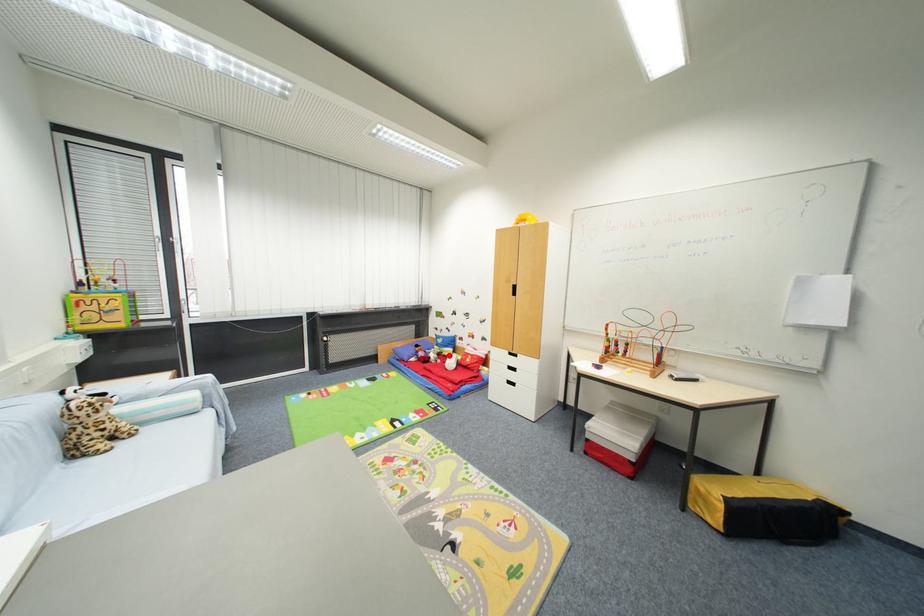
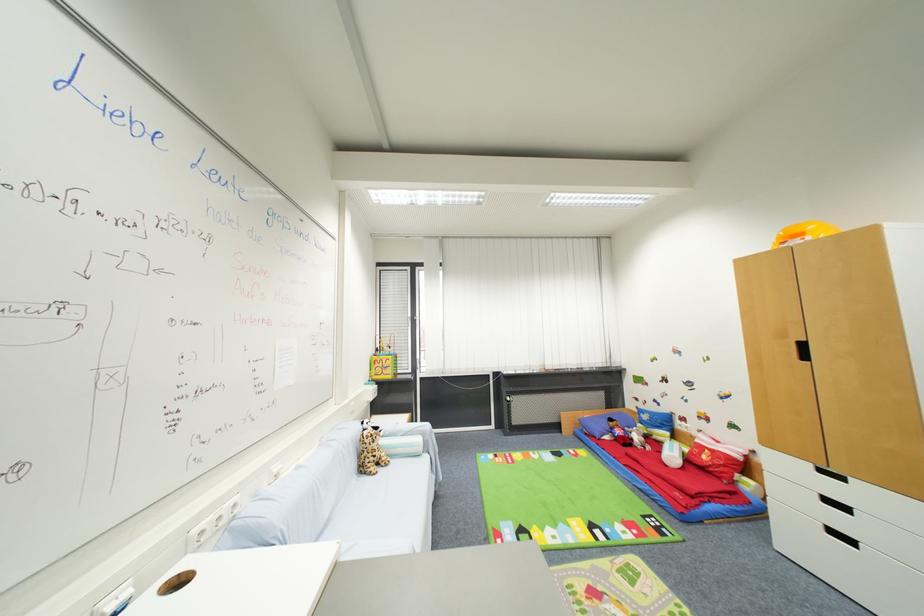
The point at the highlighted location is marked in the first image. Where is the corresponding point in the second image?

(660, 439)